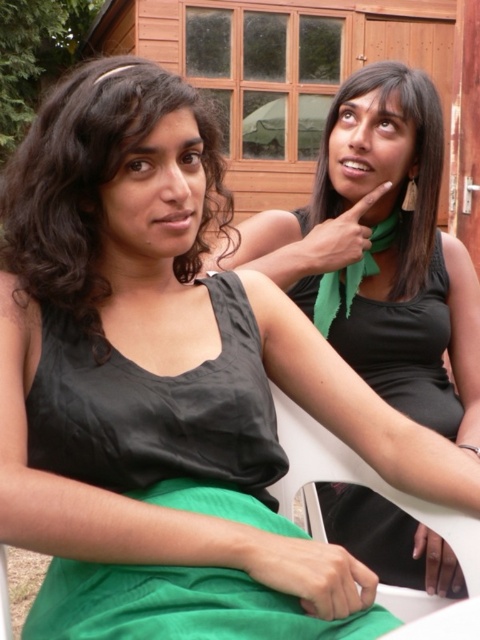
Question: Is black matte dress at center to the right of green matte scarf at upper right from the viewer's perspective?

Choices:
 (A) no
 (B) yes

Answer: (B)

Question: Which point is closer to the camera?

Choices:
 (A) matte black dress at left
 (B) black matte dress at center
 (C) green matte scarf at upper right

Answer: (A)

Question: Among these objects, which one is farthest from the camera?

Choices:
 (A) black matte dress at center
 (B) green matte scarf at upper right
 (C) matte black dress at left

Answer: (B)

Question: Which object appears closest to the camera in this image?

Choices:
 (A) black matte dress at center
 (B) green matte scarf at upper right
 (C) matte black dress at left

Answer: (C)

Question: Can you confirm if matte black dress at left is positioned above black matte dress at center?

Choices:
 (A) yes
 (B) no

Answer: (A)

Question: Is matte black dress at left in front of green matte scarf at upper right?

Choices:
 (A) yes
 (B) no

Answer: (A)